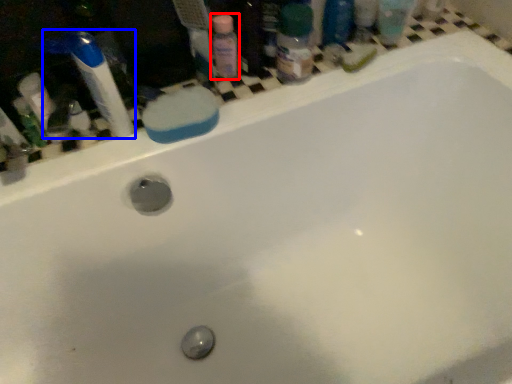
Question: Which point is closer to the camera, cleaning product (highlighted by a red box) or toothbrush (highlighted by a blue box)?

Choices:
 (A) cleaning product
 (B) toothbrush

Answer: (B)